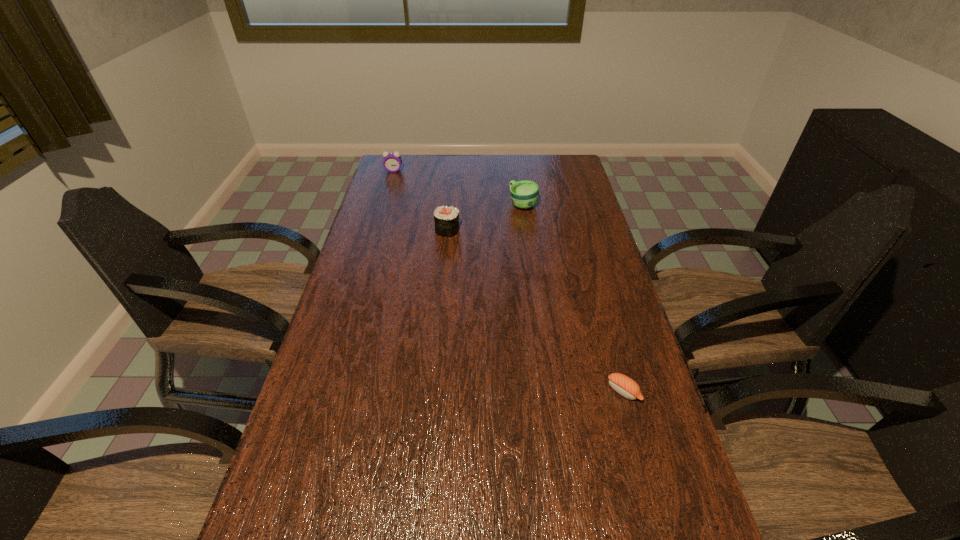
In the image, there is a desktop. What are the coordinates of `vacant space at the far right corner` in the screenshot? It's located at (544, 170).

Locate an element on the screen. This screenshot has height=540, width=960. vacant space that's between the cup and the alarm clock is located at coordinates (458, 187).

The height and width of the screenshot is (540, 960). What are the coordinates of `free space that is in between the third nearest object and the left sushi` in the screenshot? It's located at (485, 217).

Where is `vacant region between the nearest object and the cup`? This screenshot has width=960, height=540. vacant region between the nearest object and the cup is located at coordinates (573, 298).

At what (x,y) coordinates should I click in order to perform the action: click on object that ranks as the second closest to the farthest object. Please return your answer as a coordinate pair (x, y). The image size is (960, 540). Looking at the image, I should click on (524, 194).

Point out which object is positioned as the second nearest to the farther sushi. Please provide its 2D coordinates. Your answer should be formatted as a tuple, i.e. [(x, y)], where the tuple contains the x and y coordinates of a point satisfying the conditions above.

[(392, 162)]

Image resolution: width=960 pixels, height=540 pixels. Find the location of `sushi that can be found as the closest to the farthest object`. sushi that can be found as the closest to the farthest object is located at coordinates (446, 219).

At what (x,y) coordinates should I click in order to perform the action: click on free spot that satisfies the following two spatial constraints: 1. on the face of the farthest object; 2. on the left side of the second nearest object. Please return your answer as a coordinate pair (x, y). The width and height of the screenshot is (960, 540). Looking at the image, I should click on (376, 230).

Identify the location of free space in the image that satisfies the following two spatial constraints: 1. on the front side of the nearer sushi; 2. on the left side of the third nearest object. (548, 392).

This screenshot has width=960, height=540. I want to click on free location that satisfies the following two spatial constraints: 1. on the front side of the second object from right to left; 2. on the left side of the nearest object, so click(548, 392).